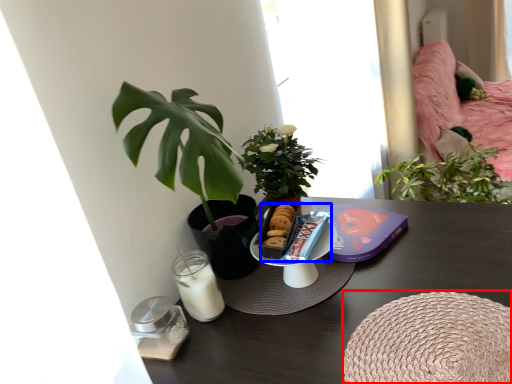
Question: Among these objects, which one is farthest to the camera, round table (highlighted by a red box) or snack (highlighted by a blue box)?

Choices:
 (A) round table
 (B) snack

Answer: (B)